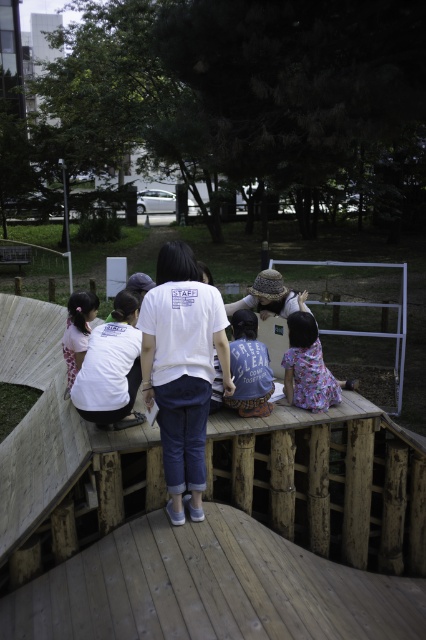
Question: Among these objects, which one is nearest to the camera?

Choices:
 (A) white matte t-shirt at center
 (B) white floral dress at lower left
 (C) white matte shirt at lower left

Answer: (A)

Question: Does white matte t-shirt at center have a smaller size compared to white floral dress at lower left?

Choices:
 (A) yes
 (B) no

Answer: (B)

Question: Which point is farther to the camera?

Choices:
 (A) (x=169, y=340)
 (B) (x=71, y=349)

Answer: (B)

Question: Which object appears farthest from the camera in this image?

Choices:
 (A) white floral dress at lower left
 (B) denim shirt at center

Answer: (A)

Question: Can you confirm if white matte t-shirt at center is positioned to the left of denim shirt at center?

Choices:
 (A) yes
 (B) no

Answer: (A)

Question: Does white matte t-shirt at center appear under white matte shirt at lower left?

Choices:
 (A) no
 (B) yes

Answer: (B)